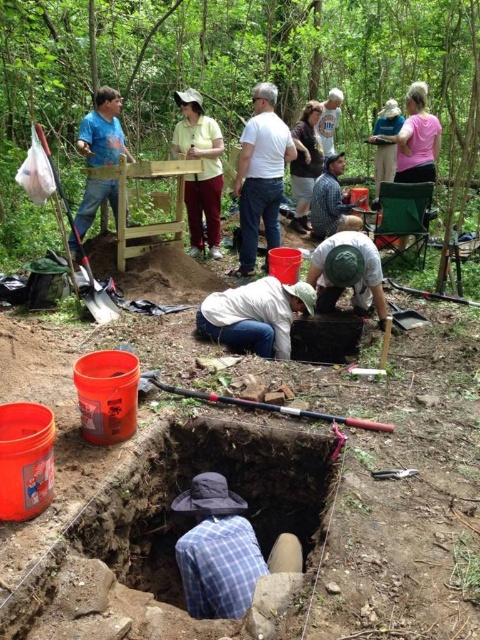
Question: Which of the following is the closest to the observer?

Choices:
 (A) white cotton shirt at center
 (B) blue denim shirt at upper center
 (C) pink fabric shirt at upper right

Answer: (C)

Question: Which object is positioned closest to the blue shirt at upper left?

Choices:
 (A) white cotton shirt at upper center
 (B) matte yellow shirt at center
 (C) brushed metal shovel at lower center
 (D) white cotton shirt at center

Answer: (B)

Question: Is blue plaid shirt at lower center further to camera compared to white cotton shirt at upper center?

Choices:
 (A) no
 (B) yes

Answer: (A)

Question: Can you confirm if white cotton shirt at upper center is bigger than blue shirt at upper left?

Choices:
 (A) no
 (B) yes

Answer: (A)

Question: Is matte yellow shirt at center thinner than brushed metal shovel at lower center?

Choices:
 (A) yes
 (B) no

Answer: (B)

Question: Which of the following is the farthest from the observer?

Choices:
 (A) (315, 198)
 (B) (386, 120)

Answer: (B)